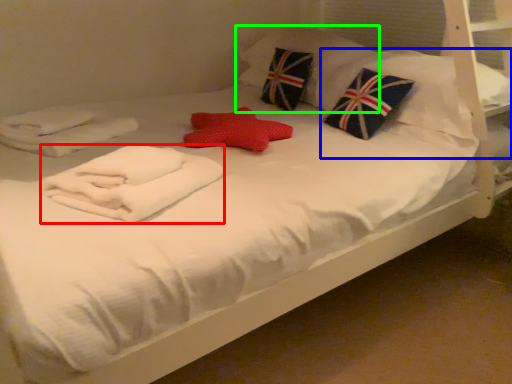
Question: Estimate the real-world distances between objects in this image. Which object is farther from material (highlighted by a red box), pillow (highlighted by a blue box) or pillow (highlighted by a green box)?

Choices:
 (A) pillow
 (B) pillow

Answer: (B)